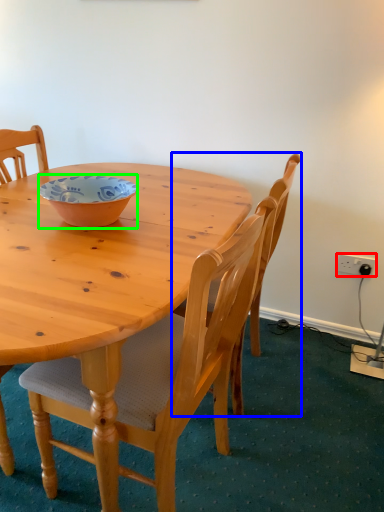
Question: Which object is positioned closest to power outlet (highlighted by a red box)? Select from chair (highlighted by a blue box) and bowl (highlighted by a green box).

Choices:
 (A) chair
 (B) bowl

Answer: (A)